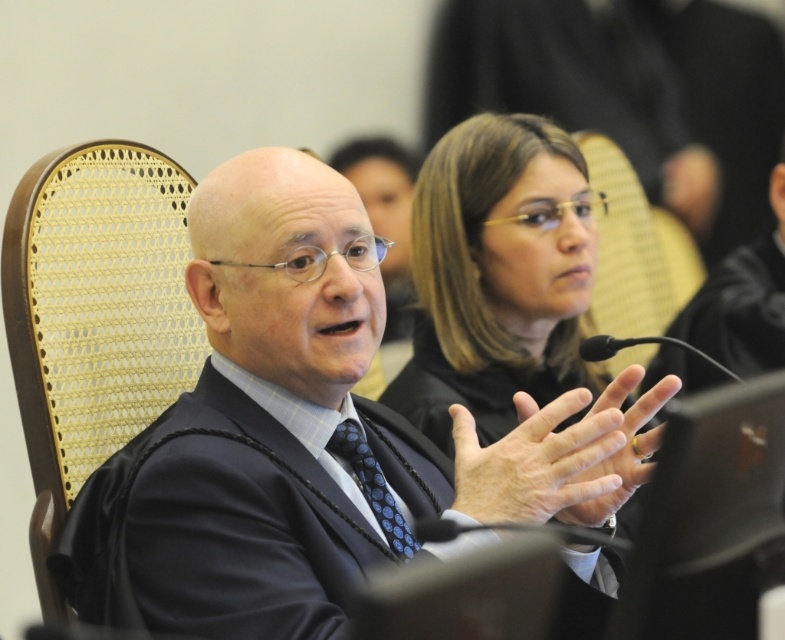
You are standing in the conference room and want to take a photo of the man in the foreground. The camera you are using has a maximum focus range of 1.5 meters. Can you capture a clear photo of the man at point (6,337)?

The point (6,337) is 1.54 meters away from the camera. Since the camera can only focus up to 1.5 meters, the photo may not be clear as the distance exceeds the maximum focus range.